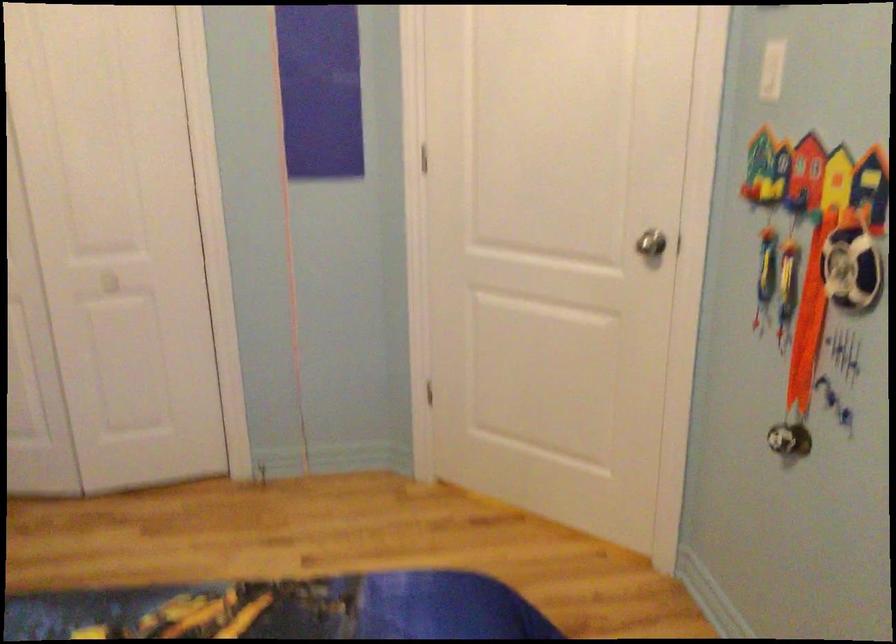
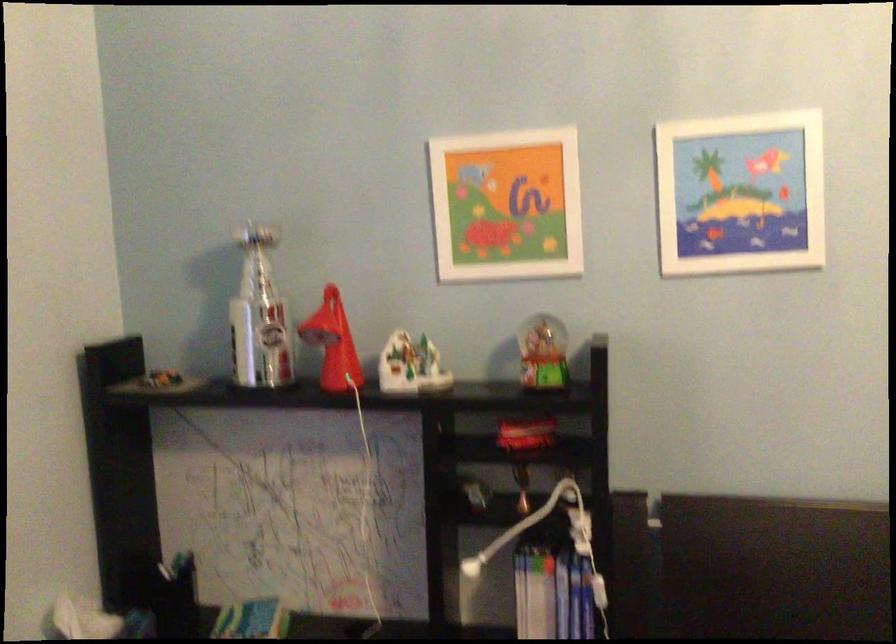
How did the camera likely rotate?

The camera's rotation is toward left-down.